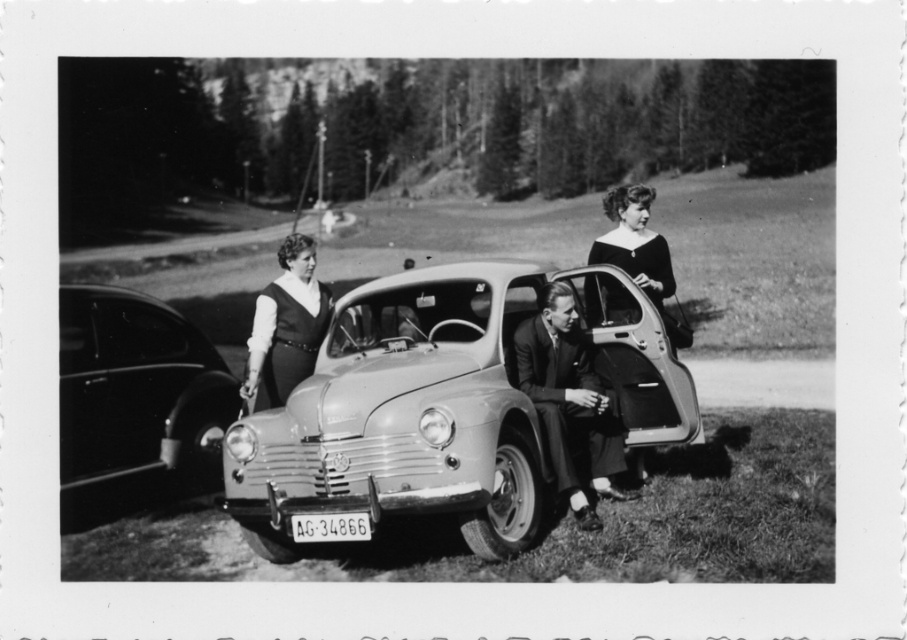
Which is behind, point (66, 497) or point (630, 234)?

The point (630, 234) is behind.

Can you confirm if shiny black car at left is positioned to the right of smooth black dress at center?

Incorrect, shiny black car at left is not on the right side of smooth black dress at center.

Image resolution: width=907 pixels, height=640 pixels. Describe the element at coordinates (135, 404) in the screenshot. I see `shiny black car at left` at that location.

At what (x,y) coordinates should I click in order to perform the action: click on shiny black car at left. Please return your answer as a coordinate pair (x, y). The width and height of the screenshot is (907, 640). Looking at the image, I should click on (135, 404).

Looking at this image, who is more forward, (644, 218) or (324, 520)?

Point (324, 520)

Is smooth black dress at center taller than metallic gray license plate at center?

Indeed, smooth black dress at center has a greater height compared to metallic gray license plate at center.

Measure the distance between point (632,228) and camera.

Point (632,228) and camera are 9.23 meters apart.

Identify the location of smooth black dress at center. (637, 248).

Who is positioned more to the right, metallic gray car at center or smooth black dress at center?

From the viewer's perspective, smooth black dress at center appears more on the right side.

Is metallic gray car at center thinner than smooth black dress at center?

Incorrect, metallic gray car at center's width is not less than smooth black dress at center's.

Which is behind, point (421, 360) or point (600, 301)?

The point (600, 301) is behind.

This screenshot has width=907, height=640. Find the location of `metallic gray car at center`. metallic gray car at center is located at coordinates (x=447, y=404).